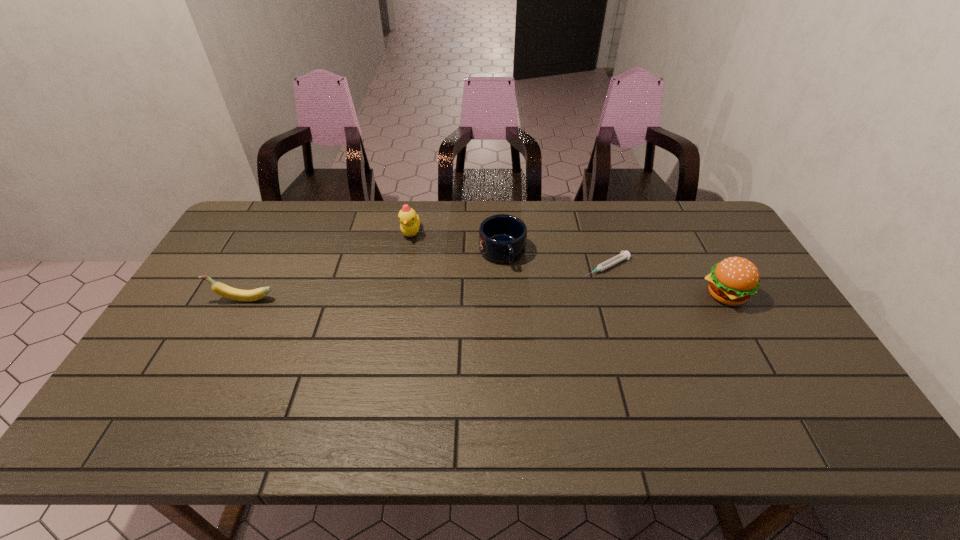
Image resolution: width=960 pixels, height=540 pixels. Find the location of `the leftmost object`. the leftmost object is located at coordinates (219, 288).

Find the location of `hamburger`. hamburger is located at coordinates (732, 281).

The width and height of the screenshot is (960, 540). Find the location of `the third object from right to left`. the third object from right to left is located at coordinates (502, 238).

Identify the location of duckling. (410, 222).

The height and width of the screenshot is (540, 960). Find the location of `syringe`. syringe is located at coordinates (623, 255).

Locate an element on the screen. The height and width of the screenshot is (540, 960). the shortest object is located at coordinates (623, 255).

Locate an element on the screen. Image resolution: width=960 pixels, height=540 pixels. free location located at the stem of the leftmost object is located at coordinates (188, 299).

You are a GUI agent. You are given a task and a screenshot of the screen. Output one action in this format:
    pyautogui.click(x=<x>, y=<y>)
    Task: Click on the vacant space located 0.060m on the right of the hamburger
    
    Given the screenshot: What is the action you would take?
    pyautogui.click(x=768, y=295)

The height and width of the screenshot is (540, 960). Find the location of `free region located 0.060m with the handle on the side of the third object from left to right`. free region located 0.060m with the handle on the side of the third object from left to right is located at coordinates (514, 285).

Where is `vacant space located with the handle on the side of the third object from left to right`? vacant space located with the handle on the side of the third object from left to right is located at coordinates (522, 306).